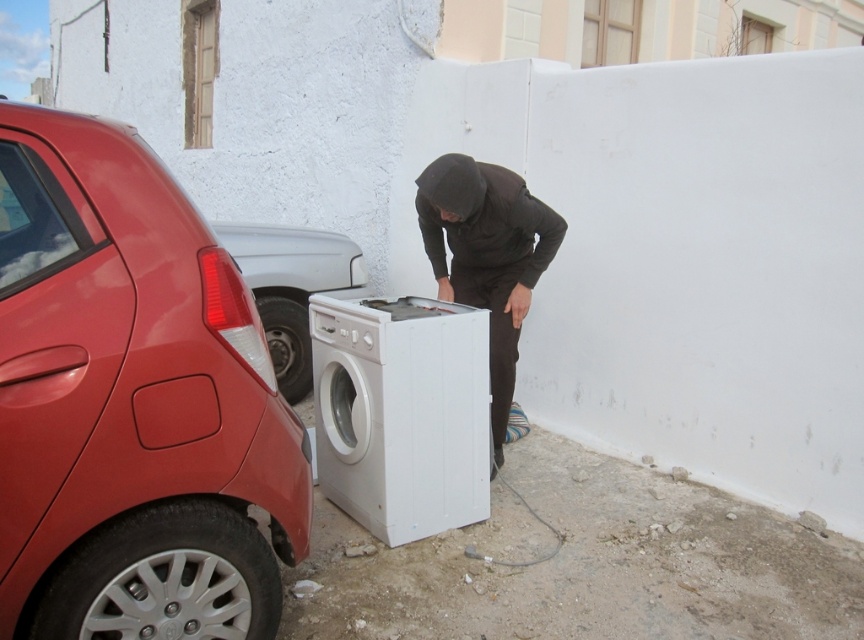
Looking at this image, you are standing at the point with coordinates point (478, 440) and want to walk towards the point (293, 388). Which direction should you move?

You should move backward because point (478, 440) is in front of point (293, 388). Since you are at the front point, moving backward will take you toward the other point.

You are a delivery person who needs to park your van next to the dark brown hoodie at center and the metallic red car at left. Based on their sizes, which object should you avoid placing your van too close to?

You should avoid placing the van too close to the metallic red car at left because the dark brown hoodie at center occupies less space, meaning the metallic red car at left takes up more space and requires more clearance.